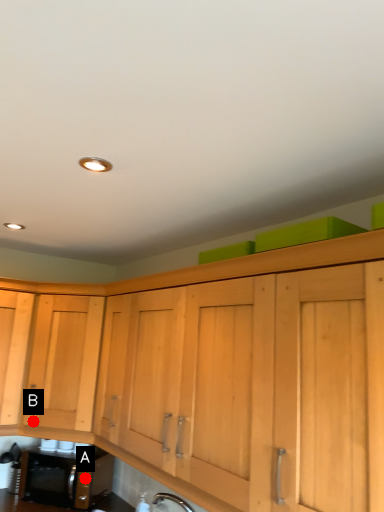
Question: Two points are circled on the image, labeled by A and B beside each circle. Which point is closer to the camera?

Choices:
 (A) A is closer
 (B) B is closer

Answer: (A)